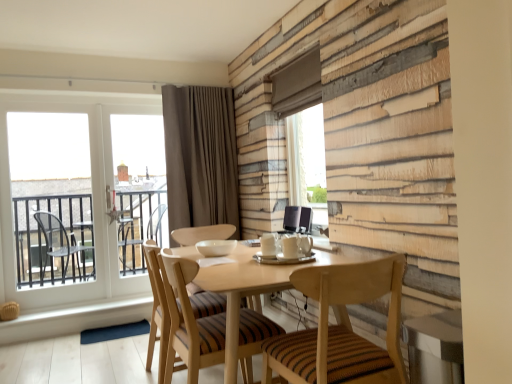
Question: Does brown velvet curtain at upper center lie in front of light wood textured chair at center, which is the 2th chair from right to left?

Choices:
 (A) no
 (B) yes

Answer: (A)

Question: From a real-world perspective, is brown velvet curtain at upper center physically below light wood textured chair at center, which is the 2th chair from right to left?

Choices:
 (A) no
 (B) yes

Answer: (A)

Question: Is light wood textured chair at center, arranged as the first chair when viewed from the left, at the back of brown velvet curtain at upper center?

Choices:
 (A) yes
 (B) no

Answer: (B)

Question: Is brown velvet curtain at upper center to the left of light wood textured chair at center, arranged as the first chair when viewed from the left, from the viewer's perspective?

Choices:
 (A) yes
 (B) no

Answer: (A)

Question: Is light wood textured chair at center, which is the 2th chair from right to left, located within brown velvet curtain at upper center?

Choices:
 (A) yes
 (B) no

Answer: (B)

Question: From a real-world perspective, is light wood textured chair at center, arranged as the first chair when viewed from the left, above or below brown velvet curtain at upper center?

Choices:
 (A) below
 (B) above

Answer: (A)

Question: From the image's perspective, is light wood textured chair at center, arranged as the first chair when viewed from the left, above or below brown velvet curtain at upper center?

Choices:
 (A) below
 (B) above

Answer: (A)

Question: Is light wood textured chair at center, which is the 2th chair from right to left, in front of or behind brown velvet curtain at upper center in the image?

Choices:
 (A) behind
 (B) front

Answer: (B)

Question: Considering the relative positions of light wood textured chair at center, which is the 2th chair from right to left, and brown velvet curtain at upper center in the image provided, is light wood textured chair at center, which is the 2th chair from right to left, to the left or to the right of brown velvet curtain at upper center?

Choices:
 (A) left
 (B) right

Answer: (B)

Question: In the image, is wooden striped chair at center, acting as the 1th chair starting from the right, positioned in front of or behind brown velvet curtain at upper center?

Choices:
 (A) behind
 (B) front

Answer: (B)

Question: Do you think wooden striped chair at center, acting as the 1th chair starting from the right, is within brown velvet curtain at upper center, or outside of it?

Choices:
 (A) inside
 (B) outside

Answer: (B)

Question: Is wooden striped chair at center, acting as the 1th chair starting from the right, taller or shorter than brown velvet curtain at upper center?

Choices:
 (A) tall
 (B) short

Answer: (B)

Question: From the image's perspective, relative to brown velvet curtain at upper center, is wooden striped chair at center, acting as the 1th chair starting from the right, above or below?

Choices:
 (A) below
 (B) above

Answer: (A)

Question: From the image's perspective, is white glass window at left located above or below transparent glass window screen at upper center, the 1th window screen from the right?

Choices:
 (A) above
 (B) below

Answer: (B)

Question: Considering the relative positions of white glass window at left and transparent glass window screen at upper center, arranged as the second window screen when viewed from the left, in the image provided, is white glass window at left to the left or to the right of transparent glass window screen at upper center, arranged as the second window screen when viewed from the left,?

Choices:
 (A) right
 (B) left

Answer: (B)